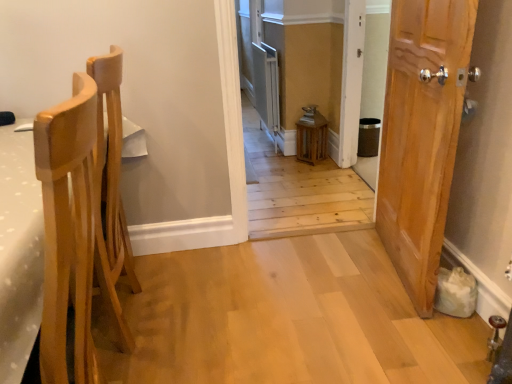
The height and width of the screenshot is (384, 512). Find the location of `vacant space in front of wooden door at right`. vacant space in front of wooden door at right is located at coordinates (399, 339).